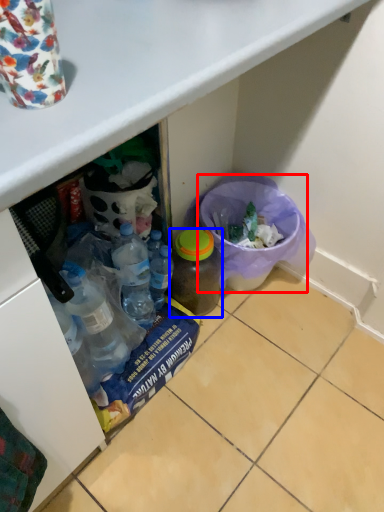
Question: Which object appears farthest to the camera in this image, recycling bin (highlighted by a red box) or bottle (highlighted by a blue box)?

Choices:
 (A) recycling bin
 (B) bottle

Answer: (A)